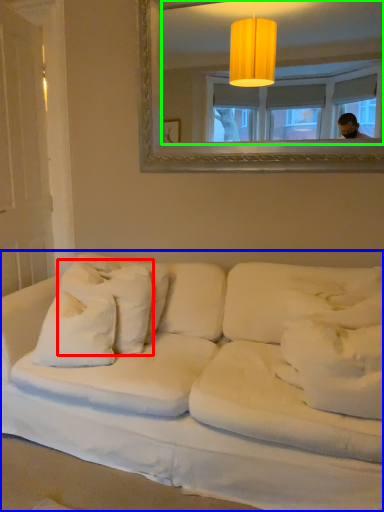
Question: Estimate the real-world distances between objects in this image. Which object is farther from pillow (highlighted by a red box), studio couch (highlighted by a blue box) or mirror (highlighted by a green box)?

Choices:
 (A) studio couch
 (B) mirror

Answer: (B)